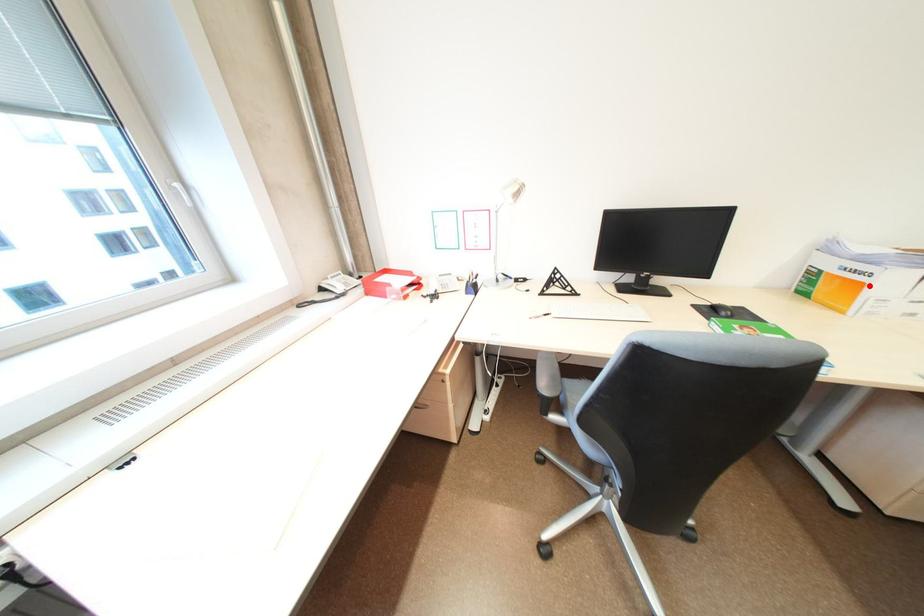
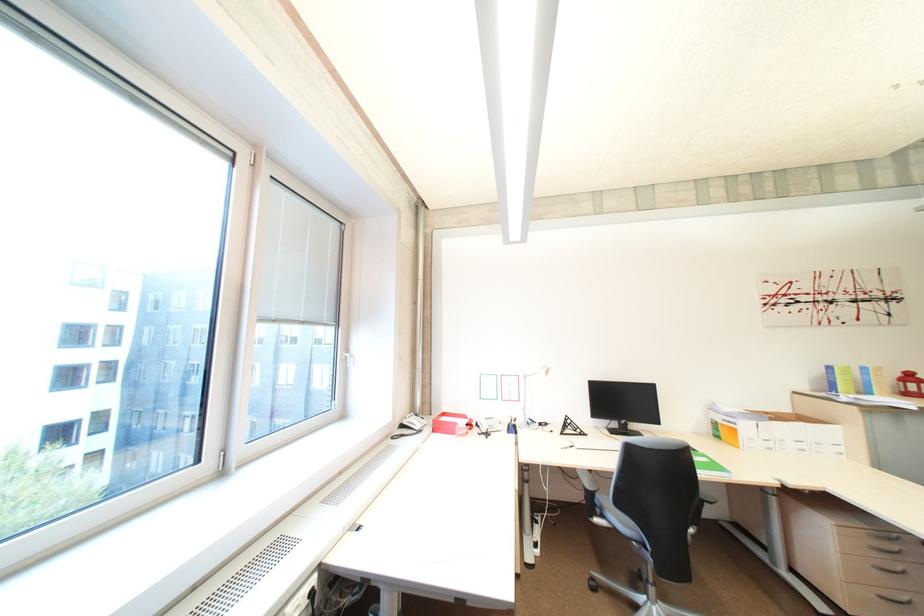
In the second image, find the point that corresponds to the highlighted location in the first image.

(745, 431)